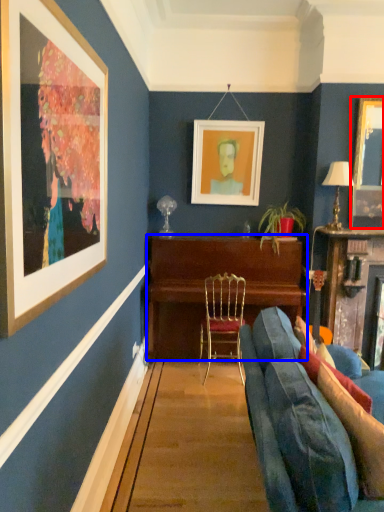
Question: Which object appears farthest to the camera in this image, picture frame (highlighted by a red box) or desk (highlighted by a blue box)?

Choices:
 (A) picture frame
 (B) desk

Answer: (B)